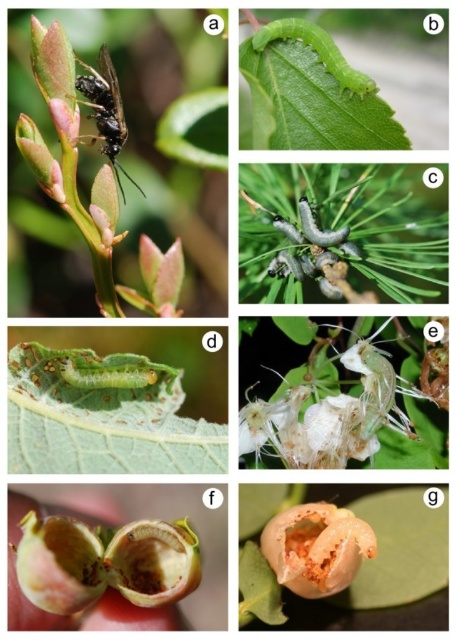
Question: Which object is the closest to the black matte insect at upper center?

Choices:
 (A) gray-green fuzzy caterpillar at center
 (B) green matte caterpillar at upper center
 (C) green matte leaf at upper left
 (D) translucent orange flower at center

Answer: (C)

Question: Among these objects, which one is farthest from the camera?

Choices:
 (A) translucent orange flower at center
 (B) gray-green fuzzy caterpillar at center
 (C) green matte caterpillar at upper center
 (D) black matte insect at upper center

Answer: (C)

Question: In this image, where is gray-green fuzzy caterpillar at center located relative to green matte caterpillar at upper center?

Choices:
 (A) above
 (B) below

Answer: (B)

Question: Is translucent orange flower at center to the right of green matte caterpillar at upper center from the viewer's perspective?

Choices:
 (A) no
 (B) yes

Answer: (A)

Question: Is gray-green fuzzy caterpillar at center smaller than black matte insect at upper center?

Choices:
 (A) no
 (B) yes

Answer: (A)

Question: Among these objects, which one is farthest from the camera?

Choices:
 (A) black matte insect at upper center
 (B) gray-green fuzzy caterpillar at center
 (C) green matte caterpillar at upper center

Answer: (C)